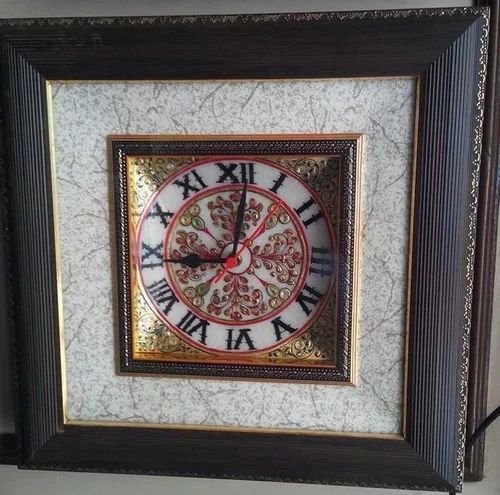
Identify the location of open grey wall space, bottom. This screenshot has height=495, width=500. (184, 479), (61, 476).